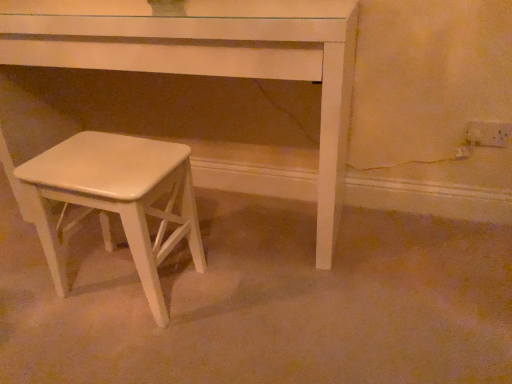
You are a GUI agent. You are given a task and a screenshot of the screen. Output one action in this format:
    pyautogui.click(x=<x>, y=<y>)
    Task: Click on the free location above white glossy stool at lower left (from a real-world perspective)
    This screenshot has height=384, width=512.
    Given the screenshot: What is the action you would take?
    pyautogui.click(x=110, y=156)